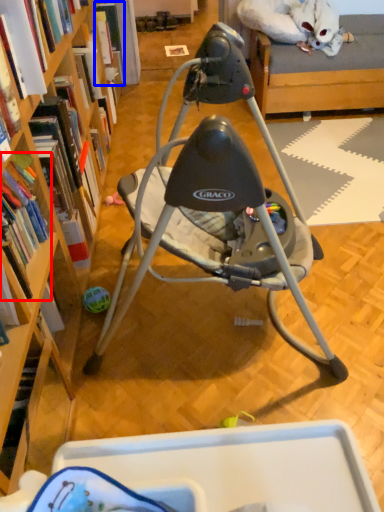
Question: Which of the following is the farthest to the observer, book (highlighted by a red box) or book (highlighted by a blue box)?

Choices:
 (A) book
 (B) book

Answer: (B)